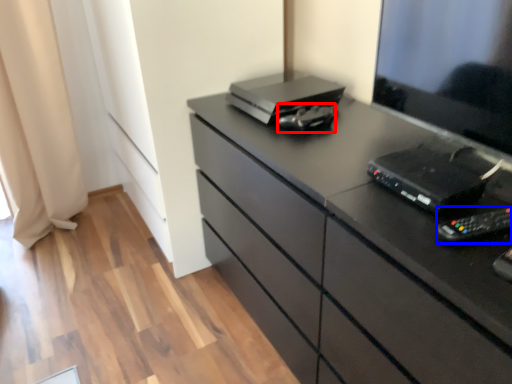
Question: Which point is further to the camera, equipment (highlighted by a red box) or equipment (highlighted by a blue box)?

Choices:
 (A) equipment
 (B) equipment

Answer: (A)